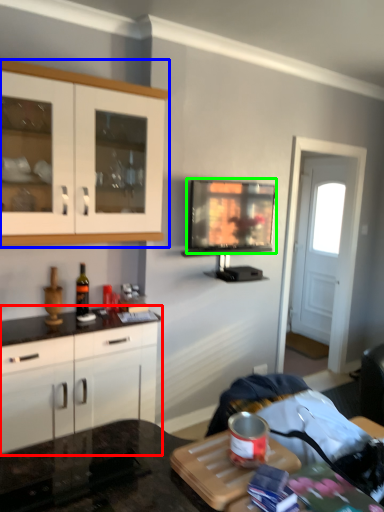
Question: Which object is positioned closest to cabinetry (highlighted by a red box)? Select from cabinetry (highlighted by a blue box) and television (highlighted by a green box).

Choices:
 (A) cabinetry
 (B) television

Answer: (A)